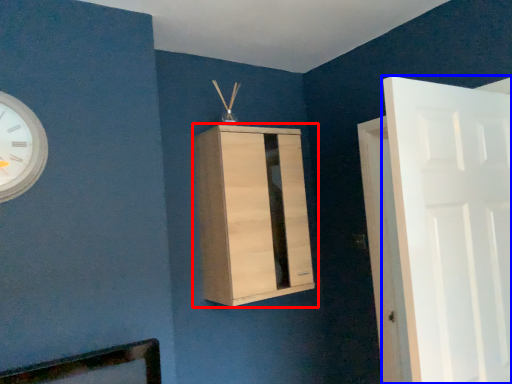
Question: Among these objects, which one is farthest to the camera, cupboard (highlighted by a red box) or door (highlighted by a blue box)?

Choices:
 (A) cupboard
 (B) door

Answer: (A)